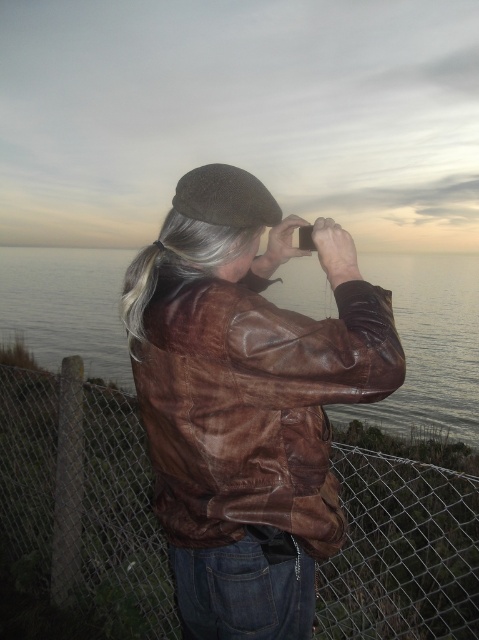
The scene shows a person taking a photo of the ocean. The person is holding a smartphone at point (429,344). Where is the brown leather water located in relation to the smartphone?

The brown leather water at center is located at point (429,344), which is the same location as the smartphone the person is holding.

You are a photographer trying to capture the perfect shot of the ocean. You notice the brown leather water at center and the brown felt beret at upper center in your viewfinder. Which object appears taller in the frame?

The brown leather water at center appears taller than the brown felt beret at upper center in the frame.

You are a photographer trying to capture the scene in front of you. You notice the brown leather jacket at center and the brown felt beret at upper center. Which object is positioned closer to your camera lens?

The brown leather jacket at center is closer to the viewer than the brown felt beret at upper center, so the brown leather jacket at center would be closer to the camera lens.